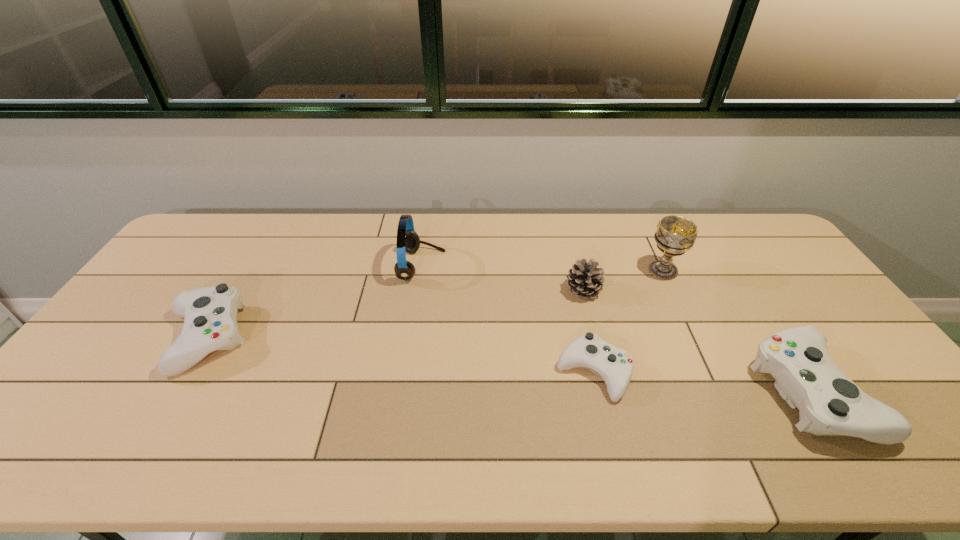
If equal spacing is the goal by inserting an additional control among them, please point out a vacant space for this new control. Please provide its 2D coordinates. Your answer should be formatted as a tuple, i.e. [(x, y)], where the tuple contains the x and y coordinates of a point satisfying the conditions above.

[(393, 355)]